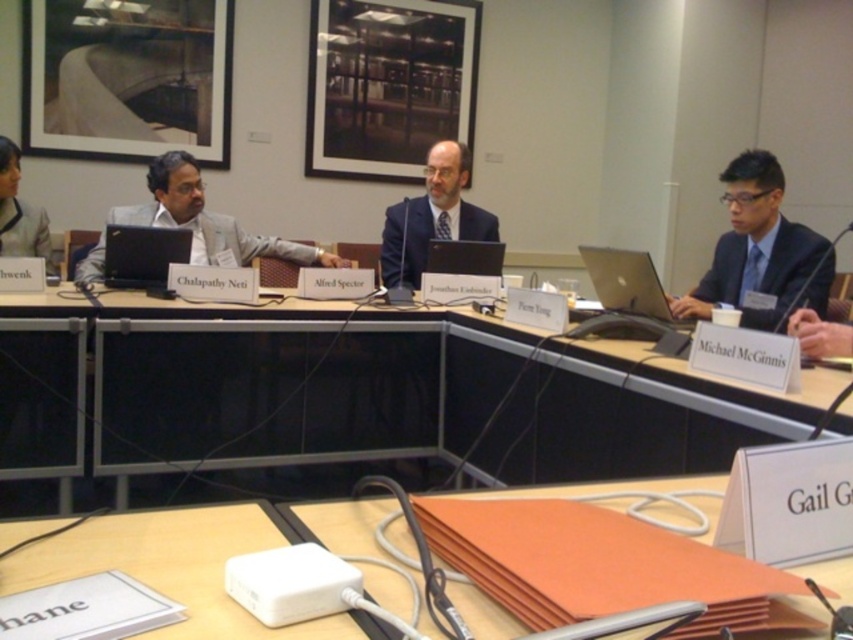
Question: Which object appears farthest from the camera in this image?

Choices:
 (A) black plastic table at center
 (B) matte blue suit at center
 (C) matte black picture frame at upper left
 (D) light gray suit at center

Answer: (C)

Question: Can you confirm if orange paper at lower center is positioned to the right of matte black picture frame at upper center?

Choices:
 (A) no
 (B) yes

Answer: (B)

Question: Considering the real-world distances, which object is farthest from the black plastic table at center?

Choices:
 (A) matte blue suit at center
 (B) dark blue suit at right
 (C) matte black laptop at left
 (D) matte black laptop at center

Answer: (C)

Question: Does black glossy laptop at center lie in front of matte black laptop at center?

Choices:
 (A) yes
 (B) no

Answer: (A)

Question: Where is dark blue suit at right located in relation to matte blue suit at center in the image?

Choices:
 (A) above
 (B) below

Answer: (B)

Question: Which object is the closest to the orange paper at lower center?

Choices:
 (A) matte black picture frame at upper left
 (B) silver metallic laptop at center
 (C) matte black picture frame at upper center
 (D) matte blue suit at center

Answer: (B)